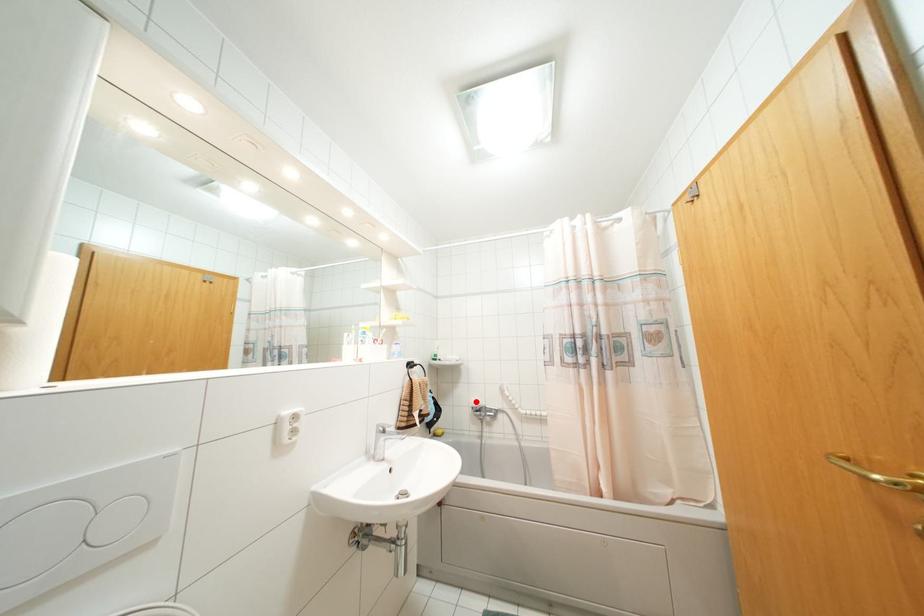
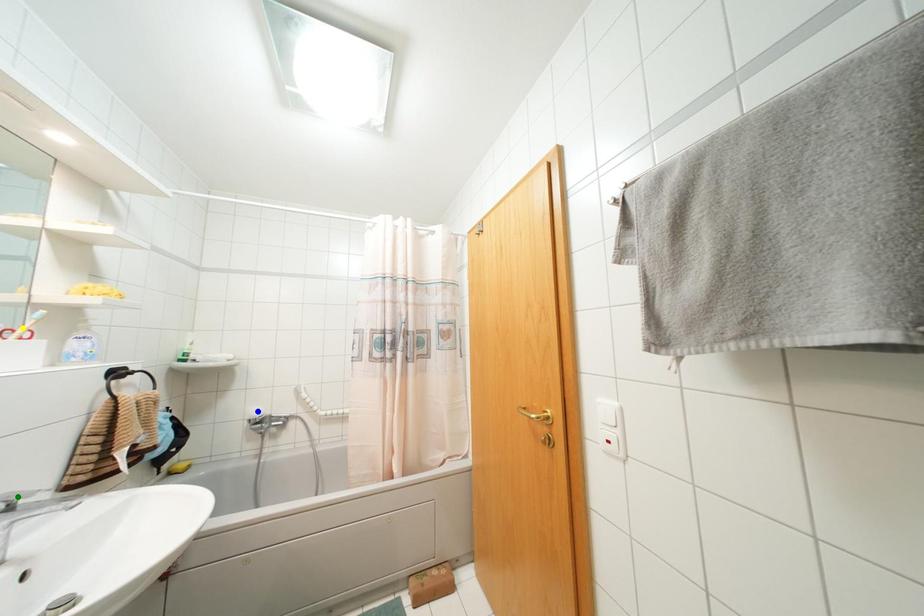
Question: I am providing you with two images of the same scene from different viewpoints. A red point is marked on the first image. You are given multiple points on the second image. Can you choose the point in image 2 that corresponds to the point in image 1?

Choices:
 (A) green point
 (B) yellow point
 (C) blue point

Answer: (C)